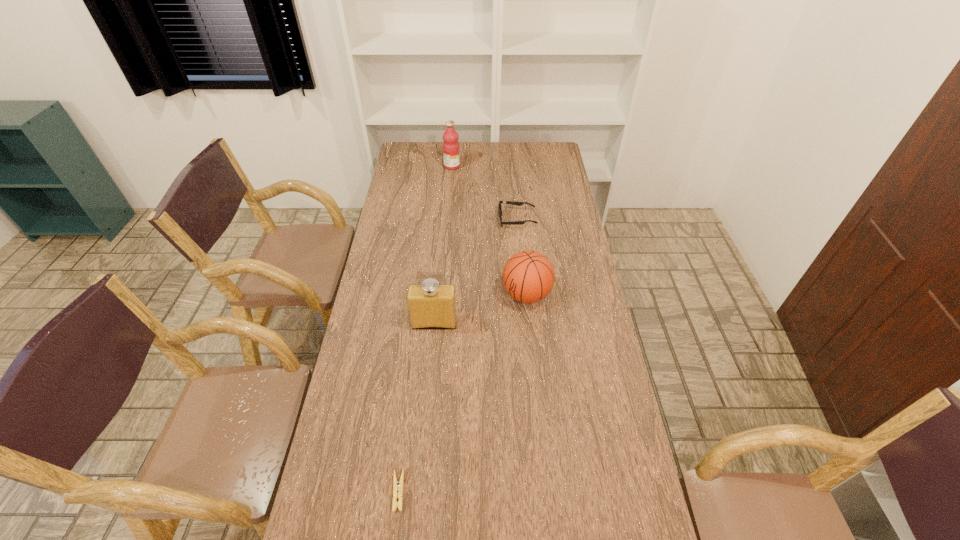
Select which object is the second closest to the clothespin. Please provide its 2D coordinates. Your answer should be formatted as a tuple, i.e. [(x, y)], where the tuple contains the x and y coordinates of a point satisfying the conditions above.

[(528, 276)]

Find the location of a particular element. The width and height of the screenshot is (960, 540). vacant space that satisfies the following two spatial constraints: 1. on the front-facing side of the sunglasses; 2. on the back side of the third nearest object is located at coordinates (524, 295).

Where is `vacant space that satisfies the following two spatial constraints: 1. on the front-facing side of the fourth nearest object; 2. on the left side of the third tallest object`? This screenshot has height=540, width=960. vacant space that satisfies the following two spatial constraints: 1. on the front-facing side of the fourth nearest object; 2. on the left side of the third tallest object is located at coordinates (524, 295).

Identify the location of vacant area that satisfies the following two spatial constraints: 1. on the front-facing side of the second farthest object; 2. on the right side of the third nearest object. (524, 295).

Find the location of a particular element. The image size is (960, 540). free location that satisfies the following two spatial constraints: 1. on the front-facing side of the second shortest object; 2. on the front-facing side of the perfume is located at coordinates (526, 323).

I want to click on vacant area in the image that satisfies the following two spatial constraints: 1. on the front-facing side of the third nearest object; 2. on the right side of the fourth tallest object, so click(x=524, y=295).

The width and height of the screenshot is (960, 540). Identify the location of free region that satisfies the following two spatial constraints: 1. on the front-facing side of the fourth nearest object; 2. on the left side of the third tallest object. (524, 295).